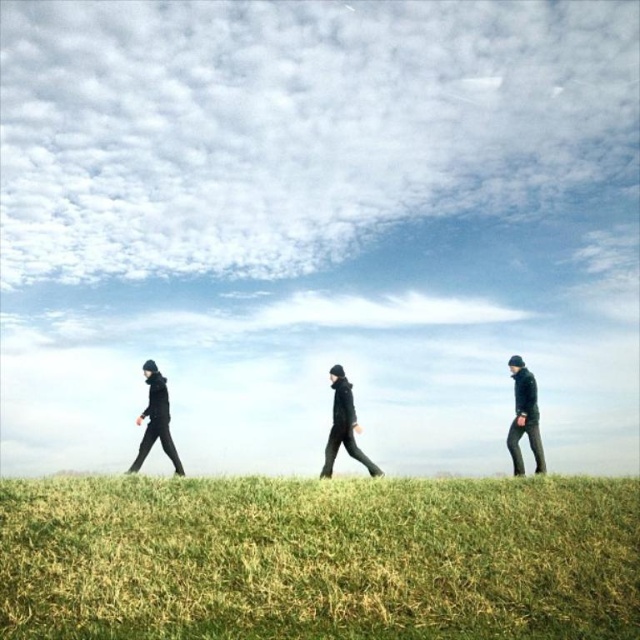
Who is more forward, (342, 410) or (156, 410)?

Positioned in front is point (156, 410).

Can you confirm if black matte jacket at center is bigger than black matte jacket at left?

Correct, black matte jacket at center is larger in size than black matte jacket at left.

Is point (353, 426) more distant than point (156, 374)?

No, it is in front of (156, 374).

The image size is (640, 640). I want to click on black matte jacket at center, so click(x=342, y=426).

Between dark green pants at right and black matte jacket at center, which one appears on the right side from the viewer's perspective?

Positioned to the right is dark green pants at right.

Does dark green pants at right appear on the right side of black matte jacket at center?

Indeed, dark green pants at right is positioned on the right side of black matte jacket at center.

Is point (512, 429) positioned before point (346, 401)?

Yes, it is.

Where is `dark green pants at right`? Image resolution: width=640 pixels, height=640 pixels. dark green pants at right is located at coordinates (524, 417).

Between green grass at lower center and dark green pants at right, which one is positioned higher?

dark green pants at right is above.

The width and height of the screenshot is (640, 640). I want to click on green grass at lower center, so click(320, 557).